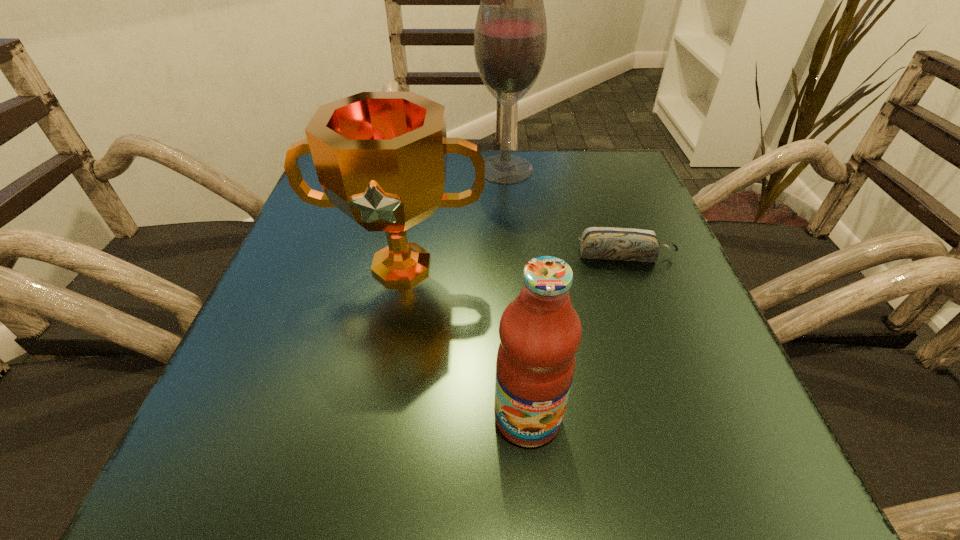
You are a GUI agent. You are given a task and a screenshot of the screen. Output one action in this format:
    pyautogui.click(x=<x>, y=<y>)
    Task: Click on the object that is at the far edge
    
    Given the screenshot: What is the action you would take?
    pyautogui.click(x=510, y=38)

Locate an element on the screen. The height and width of the screenshot is (540, 960). object that is at the near edge is located at coordinates (540, 332).

You are a GUI agent. You are given a task and a screenshot of the screen. Output one action in this format:
    pyautogui.click(x=<x>, y=<y>)
    Task: Click on the object that is at the left edge
    This screenshot has height=540, width=960.
    Given the screenshot: What is the action you would take?
    pyautogui.click(x=381, y=157)

The height and width of the screenshot is (540, 960). Find the location of `object situated at the right edge`. object situated at the right edge is located at coordinates (626, 244).

Locate an element on the screen. vacant space at the far edge of the desktop is located at coordinates (559, 151).

This screenshot has height=540, width=960. I want to click on vacant space at the near edge, so [x=320, y=457].

Identify the location of vacant area at the left edge. The height and width of the screenshot is (540, 960). (295, 256).

The width and height of the screenshot is (960, 540). In the image, there is a desktop. What are the coordinates of `vacant space at the right edge` in the screenshot? It's located at (721, 424).

What are the coordinates of `vacant space at the far right corner` in the screenshot? It's located at (643, 196).

I want to click on free spot between the award and the tallest object, so click(x=453, y=218).